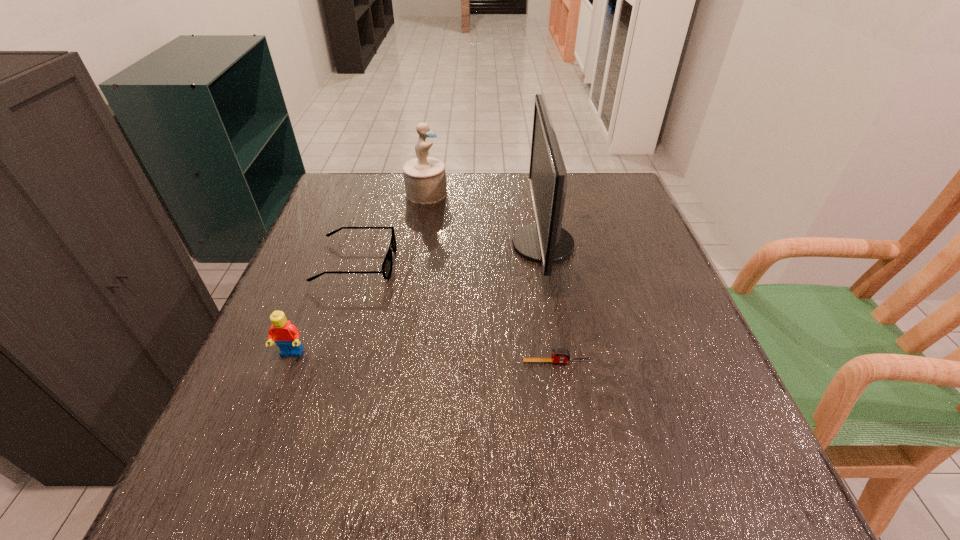
This screenshot has height=540, width=960. I want to click on the third closest object to the figurine, so click(x=286, y=335).

At what (x,y) coordinates should I click in order to perform the action: click on free spot that satisfies the following two spatial constraints: 1. on the back side of the shortest object; 2. at the beak of the fourth shortest object. Please return your answer as a coordinate pair (x, y). Image resolution: width=960 pixels, height=540 pixels. Looking at the image, I should click on (530, 193).

Image resolution: width=960 pixels, height=540 pixels. Identify the location of free space that satisfies the following two spatial constraints: 1. on the back side of the shortest object; 2. at the beak of the second tallest object. (530, 193).

The height and width of the screenshot is (540, 960). I want to click on free space that satisfies the following two spatial constraints: 1. on the screen side of the tallest object; 2. on the front side of the tape measure, so click(564, 362).

Locate an element on the screen. vacant region that satisfies the following two spatial constraints: 1. at the beak of the second tallest object; 2. on the face of the Lego is located at coordinates (398, 354).

Identify the location of vacant space that satisfies the following two spatial constraints: 1. on the front-facing side of the shortest object; 2. on the right side of the fourth tallest object. (324, 362).

Find the location of a particular element. The image size is (960, 540). vacant space that satisfies the following two spatial constraints: 1. on the screen side of the tallest object; 2. on the face of the Lego is located at coordinates (562, 354).